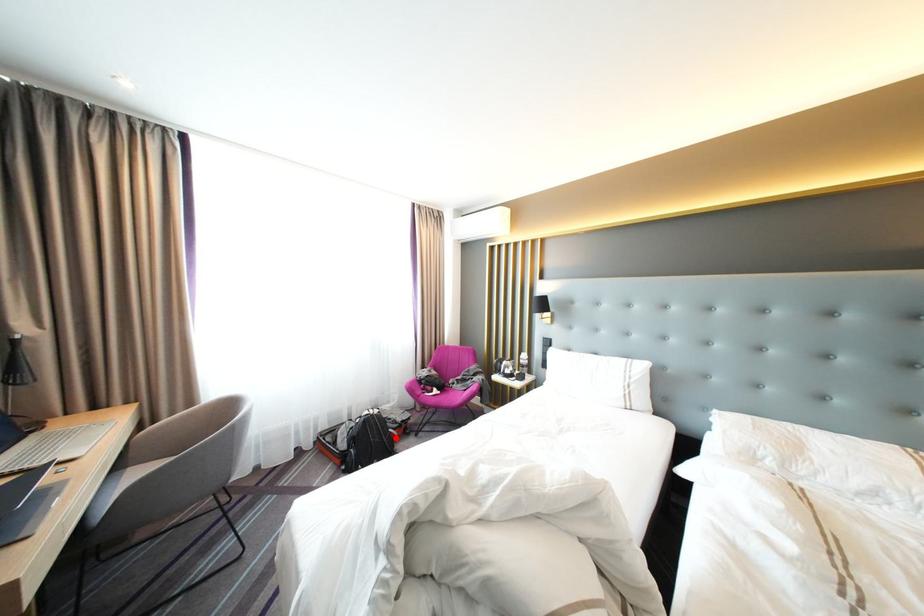
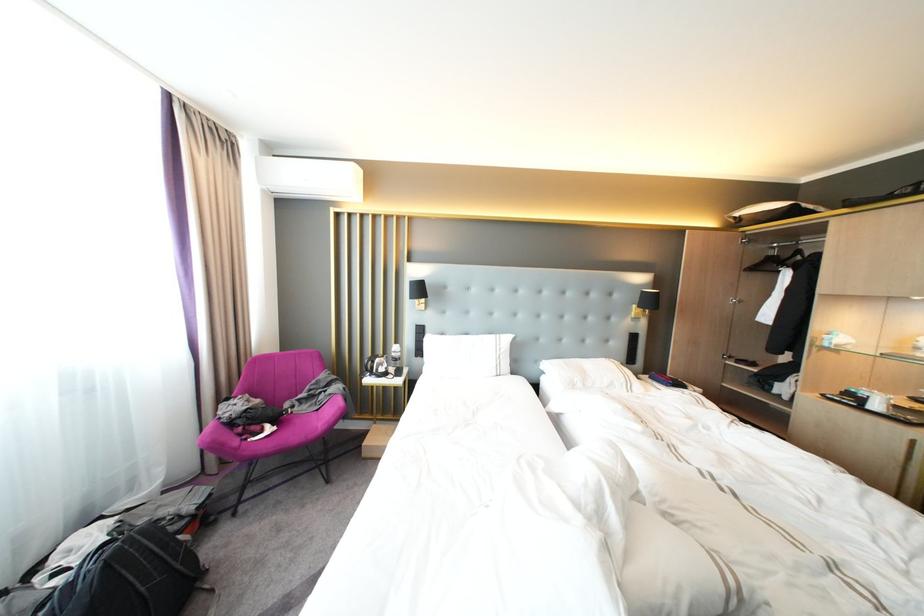
Question: I am providing you with two images of the same scene from different viewpoints. A red point is marked on the first image. Can you still see the location of the red point in image 2?

Choices:
 (A) Yes
 (B) No

Answer: (A)